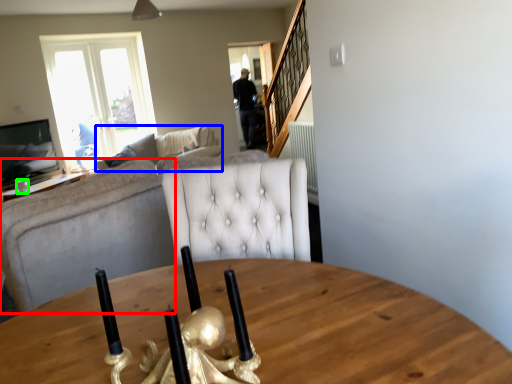
Question: Which object is positioned farthest from studio couch (highlighted by a red box)? Select from studio couch (highlighted by a blue box) and coffee cup (highlighted by a green box).

Choices:
 (A) studio couch
 (B) coffee cup

Answer: (B)